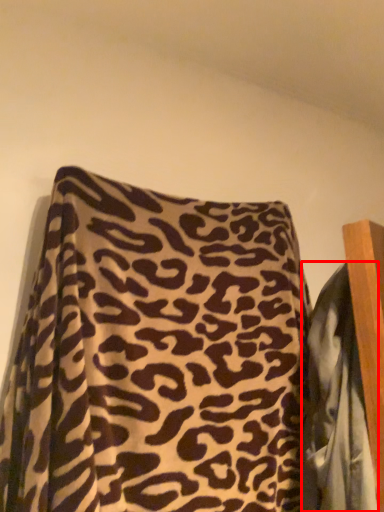
Question: From the image's perspective, where is blanket (annotated by the red box) located in relation to pillow in the image?

Choices:
 (A) below
 (B) above

Answer: (A)